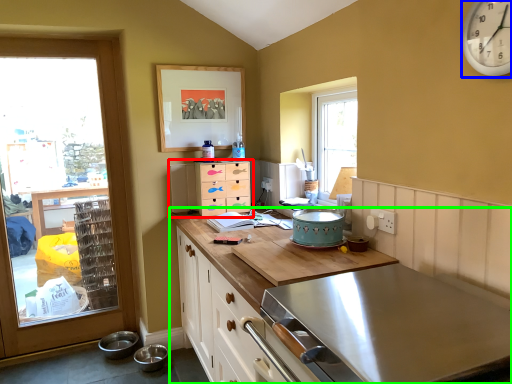
Question: Estimate the real-world distances between objects in this image. Which object is farther from chest of drawers (highlighted by a red box), clock (highlighted by a blue box) or countertop (highlighted by a green box)?

Choices:
 (A) clock
 (B) countertop

Answer: (A)